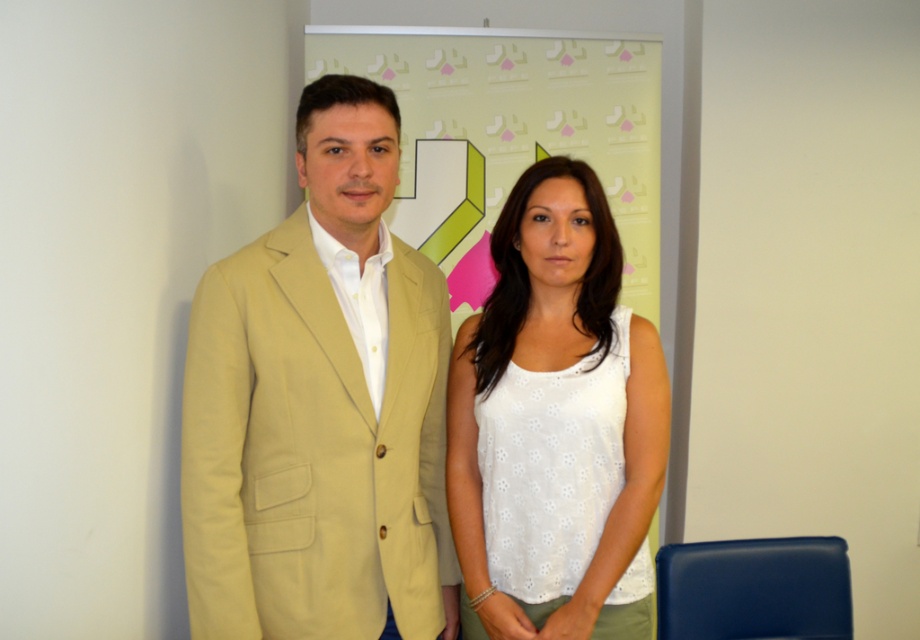
Question: Which object is closer to the camera taking this photo?

Choices:
 (A) light green fabric banner at center
 (B) white dotted tank top at center

Answer: (B)

Question: Which of the following is the closest to the observer?

Choices:
 (A) [x=584, y=164]
 (B) [x=346, y=353]
 (C) [x=578, y=100]

Answer: (B)

Question: Considering the relative positions of beige fabric suit at center and light green fabric banner at center in the image provided, where is beige fabric suit at center located with respect to light green fabric banner at center?

Choices:
 (A) above
 (B) below

Answer: (B)

Question: Is white dotted tank top at center positioned in front of light green fabric banner at center?

Choices:
 (A) yes
 (B) no

Answer: (A)

Question: Which of the following is the farthest from the observer?

Choices:
 (A) (529, 186)
 (B) (408, 547)

Answer: (A)

Question: Is beige fabric suit at center behind white dotted tank top at center?

Choices:
 (A) no
 (B) yes

Answer: (A)